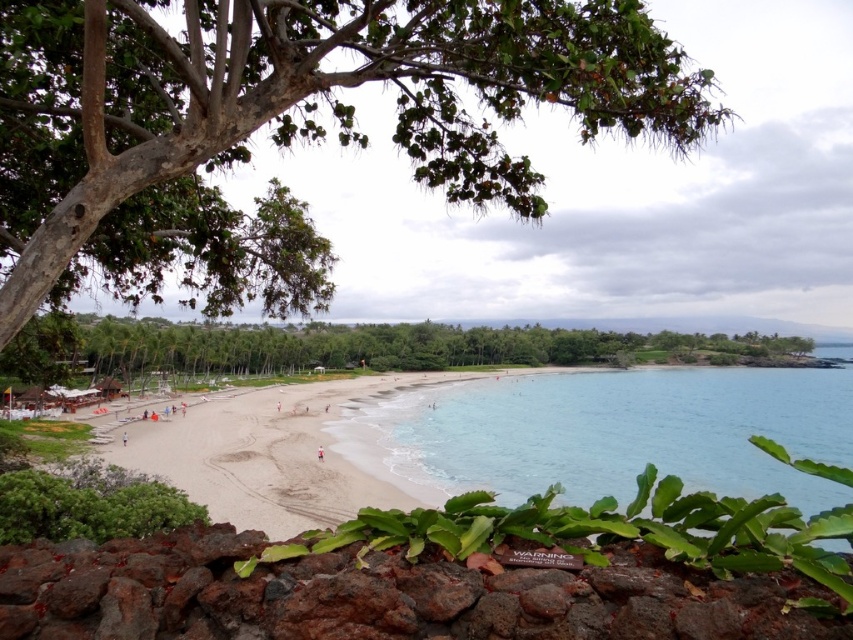
Which is above, green leafy tree at upper center or clear blue water at center?

green leafy tree at upper center

Can you confirm if green leafy tree at upper center is positioned to the left of clear blue water at center?

Correct, you'll find green leafy tree at upper center to the left of clear blue water at center.

Describe the element at coordinates (287, 113) in the screenshot. This screenshot has height=640, width=853. I see `green leafy tree at upper center` at that location.

At what (x,y) coordinates should I click in order to perform the action: click on green leafy tree at upper center. Please return your answer as a coordinate pair (x, y). Looking at the image, I should click on (287, 113).

Who is positioned more to the right, green leafy tree at upper center or white sandy beach at center?

green leafy tree at upper center

Based on the photo, who is lower down, green leafy tree at upper center or white sandy beach at center?

Positioned lower is white sandy beach at center.

You are a GUI agent. You are given a task and a screenshot of the screen. Output one action in this format:
    pyautogui.click(x=<x>, y=<y>)
    Task: Click on the green leafy tree at upper center
    Image resolution: width=853 pixels, height=640 pixels.
    Given the screenshot: What is the action you would take?
    pyautogui.click(x=287, y=113)

The image size is (853, 640). What do you see at coordinates (287, 113) in the screenshot?
I see `green leafy tree at upper center` at bounding box center [287, 113].

Is green leafy tree at upper center to the right of green leafy tree at center from the viewer's perspective?

In fact, green leafy tree at upper center is to the left of green leafy tree at center.

Is point (451, 67) positioned in front of point (259, 340)?

Yes, point (451, 67) is in front of point (259, 340).

The image size is (853, 640). In order to click on green leafy tree at upper center in this screenshot , I will do 287,113.